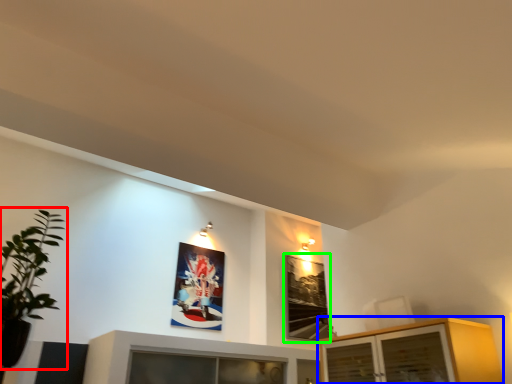
Question: Based on their relative distances, which object is nearer to houseplant (highlighted by a red box)? Choose from cabinetry (highlighted by a blue box) and picture frame (highlighted by a green box).

Choices:
 (A) cabinetry
 (B) picture frame

Answer: (A)